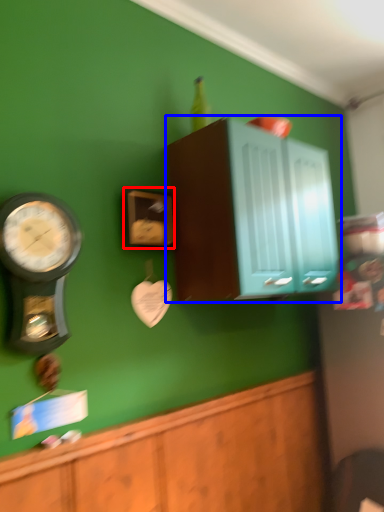
Question: Which object appears closest to the camera in this image, clock (highlighted by a red box) or cabinetry (highlighted by a blue box)?

Choices:
 (A) clock
 (B) cabinetry

Answer: (B)